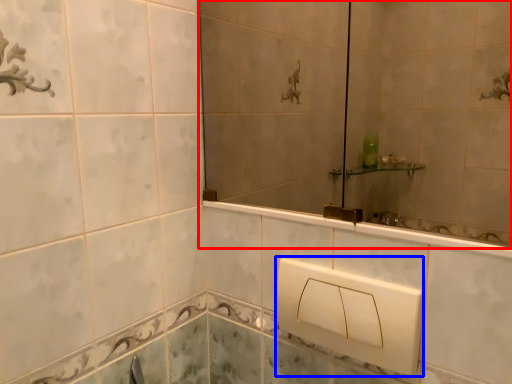
Question: Which point is closer to the camera, mirror (highlighted by a red box) or square (highlighted by a blue box)?

Choices:
 (A) mirror
 (B) square

Answer: (A)